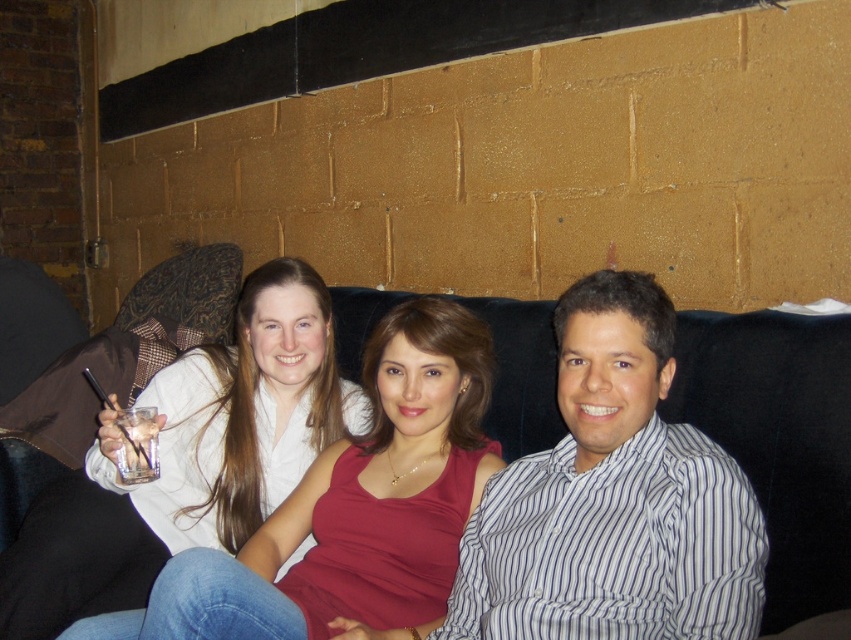
You are a photographer taking a picture of the scene. You want to ensure that the white striped shirt at center and the white matte shirt at upper left are both visible in the frame. Based on their positions, which shirt should you focus on first to capture both in the shot?

The white striped shirt at center is positioned on the right side of the white matte shirt at upper left, so focusing on the white matte shirt at upper left first would allow the photographer to include both shirts in the frame since the striped shirt is to the right of the matte one.

You are a photographer setting up for a group photo. You need to position a light source above the black fabric couch at center to highlight it. However, you also want to avoid casting a shadow on the white matte shirt at upper left. Based on the scene description, is this possible?

The white matte shirt at upper left is located below the black fabric couch at center, so placing a light source above the black fabric couch at center would cast a shadow on the white matte shirt at upper left. Therefore, it is not possible to avoid casting a shadow on the white matte shirt at upper left while positioning the light source above the black fabric couch at center.

You are a photographer setting up a shot of the scene described. You need to ensure that the white striped shirt at center and the black fabric couch at center are both visible in the frame. Given their relative heights, which object should you position closer to the camera to achieve this?

The white striped shirt at center has a greater height compared to the black fabric couch at center. To ensure both are visible, position the white striped shirt at center closer to the camera so its height doesn